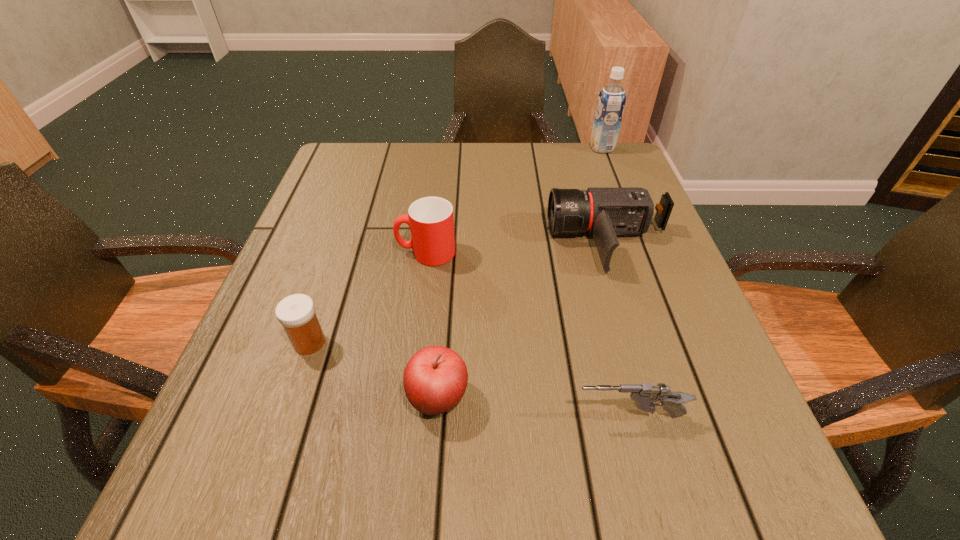
This screenshot has height=540, width=960. In the image, there is a desktop. What are the coordinates of `vacant space at the far left corner` in the screenshot? It's located at (349, 165).

This screenshot has height=540, width=960. What are the coordinates of `vacant space at the near left corner of the desktop` in the screenshot? It's located at (299, 480).

Find the location of a particular element. This screenshot has width=960, height=540. vacant region at the far right corner of the desktop is located at coordinates (588, 167).

You are a GUI agent. You are given a task and a screenshot of the screen. Output one action in this format:
    pyautogui.click(x=<x>, y=<y>)
    Task: Click on the blank region between the cup and the soya milk
    The width and height of the screenshot is (960, 540).
    Given the screenshot: What is the action you would take?
    pyautogui.click(x=514, y=200)

Where is `unoccupied area between the camcorder and the fourth farthest object`? This screenshot has width=960, height=540. unoccupied area between the camcorder and the fourth farthest object is located at coordinates (459, 292).

This screenshot has height=540, width=960. In order to click on free space between the leftmost object and the cup in this screenshot , I will do `click(368, 298)`.

This screenshot has height=540, width=960. Identify the location of free spot between the camcorder and the gun. (619, 329).

This screenshot has width=960, height=540. In order to click on vacant space that's between the camcorder and the cup in this screenshot , I will do `click(517, 247)`.

Where is `vacant area that lies between the cup and the farthest object`? This screenshot has width=960, height=540. vacant area that lies between the cup and the farthest object is located at coordinates (514, 200).

This screenshot has height=540, width=960. Find the location of `vacant area that lies between the cup and the gun`. vacant area that lies between the cup and the gun is located at coordinates (528, 334).